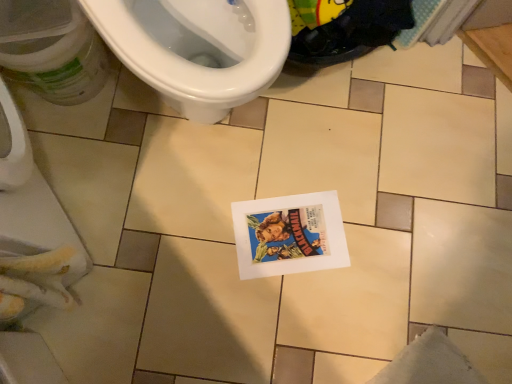
Locate an element on the screen. free space in front of white glossy toilet at upper left is located at coordinates 166,198.